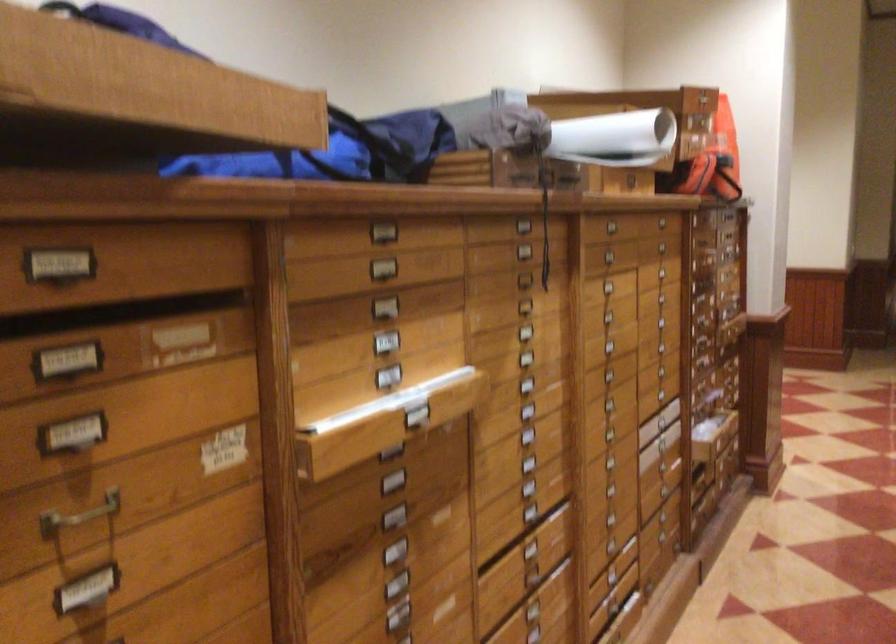
At what (x,y) coordinates should I click in order to perform the action: click on drawer pull. Please return your answer as a coordinate pair (x, y). This screenshot has height=644, width=896. Looking at the image, I should click on (79, 515).